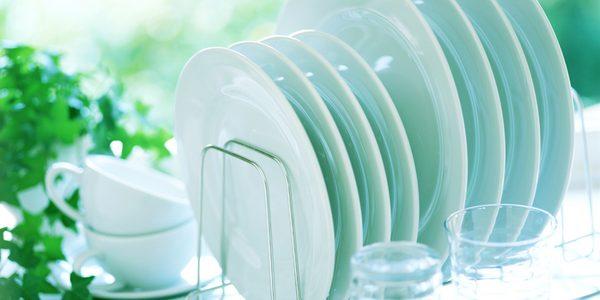
Find the location of a particular element. white plates is located at coordinates (563, 104), (525, 126), (495, 128), (457, 135), (405, 144), (378, 167), (352, 176), (324, 198).